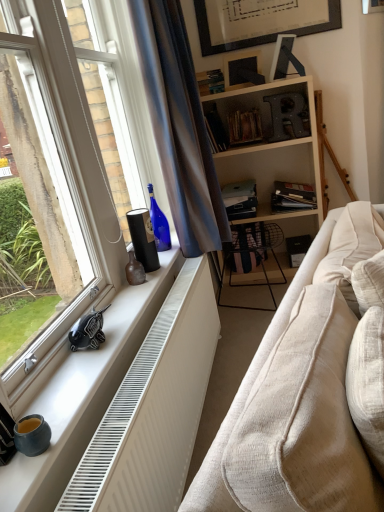
Question: Considering the relative positions of satin blue curtain at window and black matte book at center, the fourth book from the top, in the image provided, is satin blue curtain at window in front of black matte book at center, the fourth book from the top,?

Choices:
 (A) no
 (B) yes

Answer: (B)

Question: Does satin blue curtain at window appear on the right side of black matte book at center, the second book when ordered from bottom to top?

Choices:
 (A) no
 (B) yes

Answer: (A)

Question: Are satin blue curtain at window and black matte book at center, the fourth book from the top, far apart?

Choices:
 (A) yes
 (B) no

Answer: (A)

Question: From a real-world perspective, is satin blue curtain at window positioned under black matte book at center, the fourth book from the top, based on gravity?

Choices:
 (A) yes
 (B) no

Answer: (B)

Question: Is satin blue curtain at window aimed at black matte book at center, the second book when ordered from bottom to top?

Choices:
 (A) yes
 (B) no

Answer: (B)

Question: From the image's perspective, is hardcover book at center, arranged as the third book when viewed from the top, located above or below black matte book at center, the second book when ordered from bottom to top?

Choices:
 (A) below
 (B) above

Answer: (B)

Question: Do you think hardcover book at center, arranged as the third book when viewed from the top, is within black matte book at center, the fourth book from the top, or outside of it?

Choices:
 (A) inside
 (B) outside

Answer: (B)

Question: Is hardcover book at center, marked as the third book in a bottom-to-top arrangement, bigger or smaller than black matte book at center, the second book when ordered from bottom to top?

Choices:
 (A) small
 (B) big

Answer: (A)

Question: Considering the positions of point (210, 126) and point (271, 207), is point (210, 126) closer or farther from the camera than point (271, 207)?

Choices:
 (A) farther
 (B) closer

Answer: (A)

Question: In terms of height, does matte black bookshelf at center, positioned as the 1th book in bottom-to-top order, look taller or shorter compared to beige fabric couch at lower right?

Choices:
 (A) tall
 (B) short

Answer: (B)

Question: From the image's perspective, is matte black bookshelf at center, positioned as the 1th book in bottom-to-top order, located above or below beige fabric couch at lower right?

Choices:
 (A) below
 (B) above

Answer: (B)

Question: Is matte black bookshelf at center, which is counted as the 5th book, starting from the top, inside the boundaries of beige fabric couch at lower right, or outside?

Choices:
 (A) inside
 (B) outside

Answer: (B)

Question: Looking at their shapes, would you say matte black bookshelf at center, which is counted as the 5th book, starting from the top, is wider or thinner than beige fabric couch at lower right?

Choices:
 (A) thin
 (B) wide

Answer: (B)

Question: Considering the positions of brown matte vase at window sill and hardcover book at center, which appears as the 2th book when viewed from the top, in the image, is brown matte vase at window sill wider or thinner than hardcover book at center, which appears as the 2th book when viewed from the top,?

Choices:
 (A) wide
 (B) thin

Answer: (B)

Question: Visually, is brown matte vase at window sill positioned to the left or to the right of hardcover book at center, which appears as the 2th book when viewed from the top?

Choices:
 (A) right
 (B) left

Answer: (B)